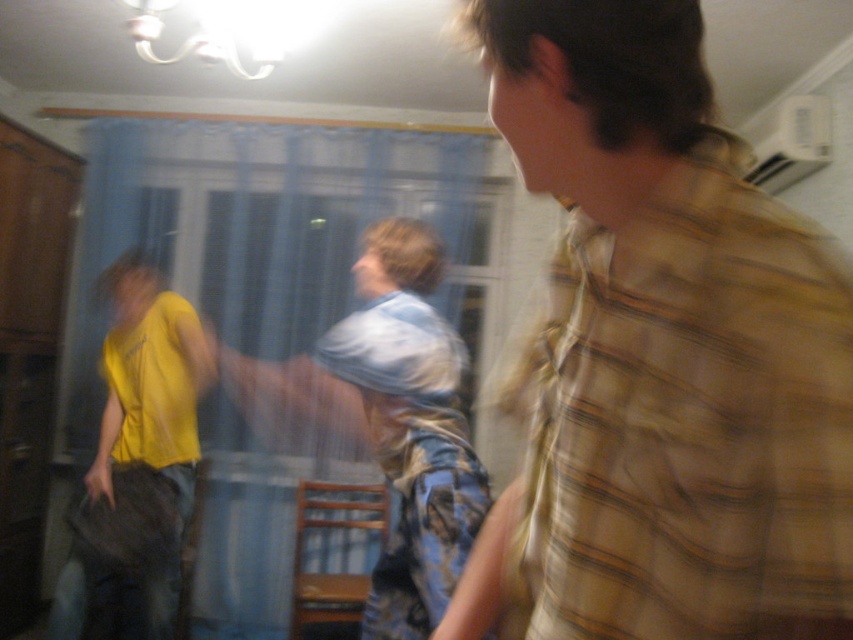
Does yellow plaid shirt at right appear on the right side of blue sheer curtain at center?

Yes, yellow plaid shirt at right is to the right of blue sheer curtain at center.

At what (x,y) coordinates should I click in order to perform the action: click on yellow plaid shirt at right. Please return your answer as a coordinate pair (x, y). This screenshot has height=640, width=853. Looking at the image, I should click on (669, 346).

Is yellow plaid shirt at right taller than yellow matte shirt at left?

No, yellow plaid shirt at right is not taller than yellow matte shirt at left.

Between yellow plaid shirt at right and yellow matte shirt at left, which one appears on the left side from the viewer's perspective?

Positioned to the left is yellow matte shirt at left.

Identify the location of yellow plaid shirt at right. The height and width of the screenshot is (640, 853). (669, 346).

Which is above, blue sheer curtain at center or yellow matte shirt at left?

blue sheer curtain at center is above.

Is blue sheer curtain at center taller than yellow matte shirt at left?

Correct, blue sheer curtain at center is much taller as yellow matte shirt at left.

Locate an element on the screen. The image size is (853, 640). blue sheer curtain at center is located at coordinates (276, 228).